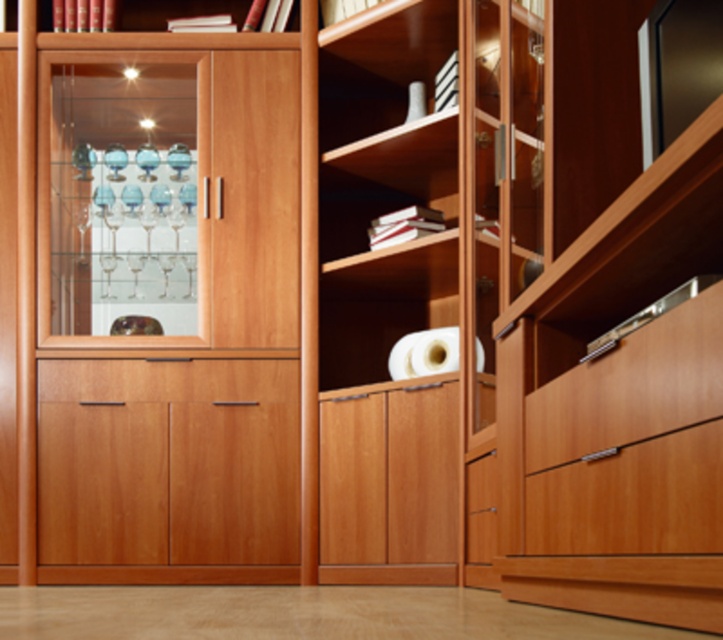
Who is shorter, wooden cabinet at center or wooden drawer at lower right?

With less height is wooden drawer at lower right.

Is point (77, 419) positioned behind point (620, 428)?

Yes, point (77, 419) is farther from viewer.

At what (x,y) coordinates should I click in order to perform the action: click on wooden cabinet at center. Please return your answer as a coordinate pair (x, y). Looking at the image, I should click on (168, 461).

Which is above, wooden cabinet at center or transparent glass cabinet at left?

transparent glass cabinet at left is higher up.

Is wooden cabinet at center further to camera compared to transparent glass cabinet at left?

No, it is in front of transparent glass cabinet at left.

Describe the element at coordinates (168, 461) in the screenshot. I see `wooden cabinet at center` at that location.

This screenshot has height=640, width=723. What are the coordinates of `wooden cabinet at center` in the screenshot? It's located at (168, 461).

Does point (54, 273) come behind point (697, 380)?

Yes, it is behind point (697, 380).

Does transparent glass cabinet at left appear on the left side of wooden drawer at lower right?

Yes, transparent glass cabinet at left is to the left of wooden drawer at lower right.

Identify the location of transparent glass cabinet at left. (124, 195).